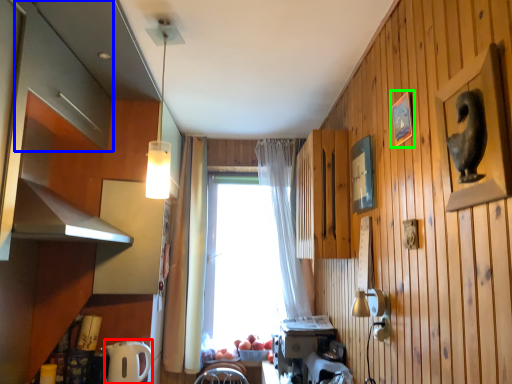
Question: Considering the real-world distances, which object is farthest from appliance (highlighted by a red box)? cabinetry (highlighted by a blue box) or picture frame (highlighted by a green box)?

Choices:
 (A) cabinetry
 (B) picture frame

Answer: (B)